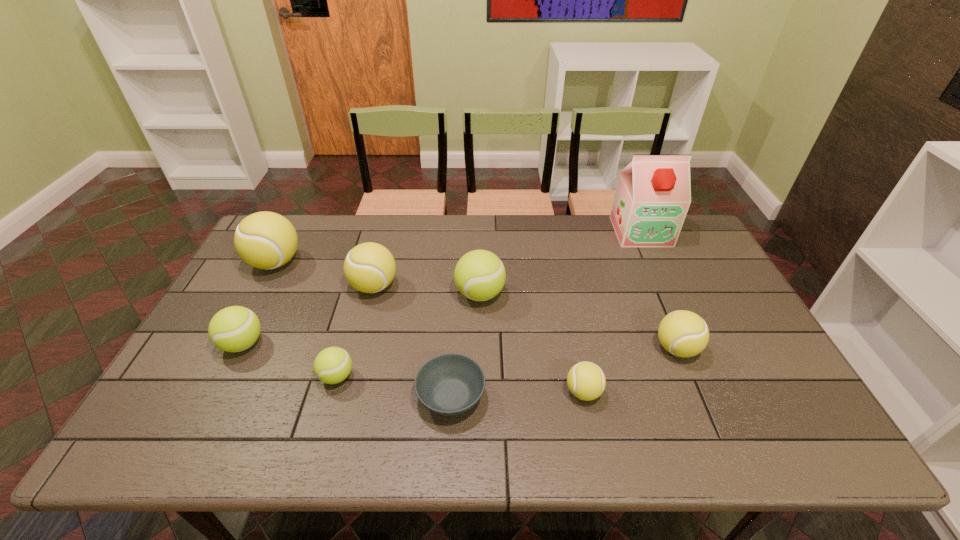
You are a GUI agent. You are given a task and a screenshot of the screen. Output one action in this format:
    pyautogui.click(x=<x>, y=<y>)
    Task: Click on the free space located 0.110m on the right of the smallest green tennis ball
    
    Given the screenshot: What is the action you would take?
    pyautogui.click(x=398, y=376)

Identify the location of vacant space situated 0.400m on the back of the nearest yellow tennis ball. (559, 271).

Find the location of a particular element. The height and width of the screenshot is (540, 960). vacant space located 0.210m on the right of the gray soup bowl is located at coordinates (572, 396).

Locate an element on the screen. The width and height of the screenshot is (960, 540). soya milk that is at the far edge is located at coordinates (653, 194).

The image size is (960, 540). I want to click on tennis ball situated at the far edge, so click(266, 240).

At what (x,y) coordinates should I click in order to perform the action: click on object at the near edge. Please return your answer as a coordinate pair (x, y). The height and width of the screenshot is (540, 960). Looking at the image, I should click on (449, 384).

The width and height of the screenshot is (960, 540). I want to click on object at the right edge, so click(653, 194).

Identify the location of object present at the far left corner. (266, 240).

Identify the location of object positioned at the far right corner. (653, 194).

I want to click on free space at the far edge of the desktop, so click(362, 236).